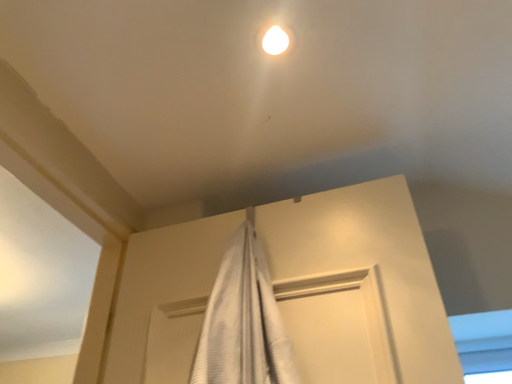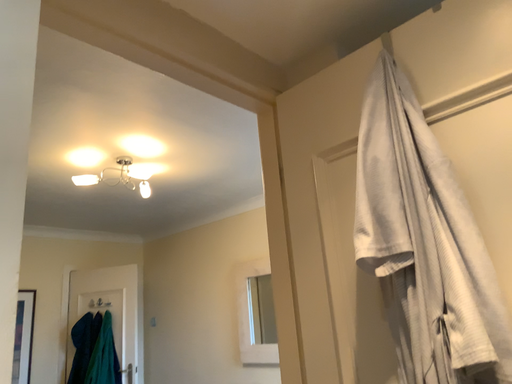
Question: How did the camera likely rotate when shooting the video?

Choices:
 (A) rotated upward
 (B) rotated downward

Answer: (B)